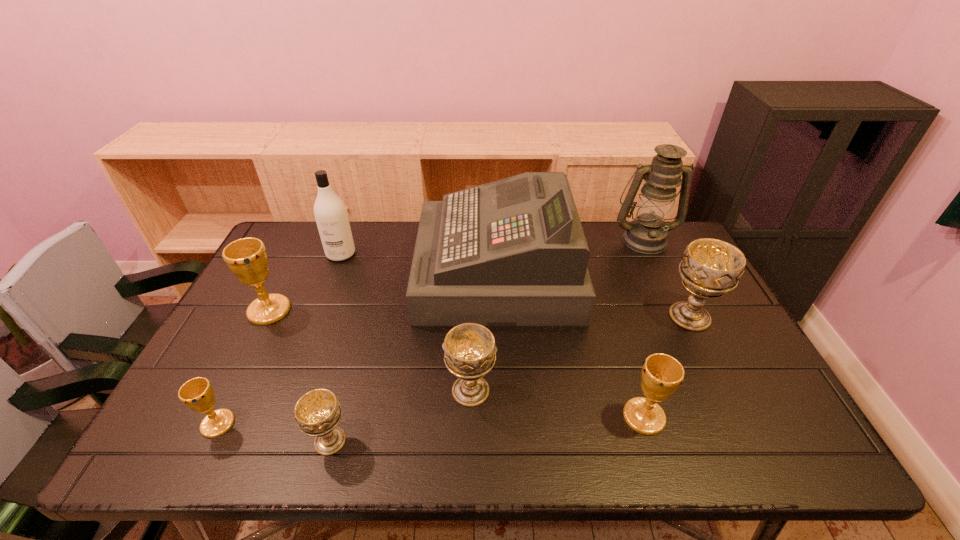
Find the location of `oil lamp`. oil lamp is located at coordinates (647, 234).

Locate an element on the screen. Image resolution: width=960 pixels, height=540 pixels. cash register is located at coordinates (512, 252).

Identify the location of white shampoo. This screenshot has height=540, width=960. (330, 213).

Find the location of a particular element. The height and width of the screenshot is (540, 960). shampoo is located at coordinates 330,213.

Locate an element on the screen. The height and width of the screenshot is (540, 960). the biggest gold chalice is located at coordinates (247, 258).

Locate an element on the screen. This screenshot has width=960, height=540. the rightmost chalice is located at coordinates (710, 268).

The image size is (960, 540). In order to click on the biggest white chalice in this screenshot , I will do `click(710, 268)`.

Where is `the second nearest white chalice`? the second nearest white chalice is located at coordinates (470, 353).

Image resolution: width=960 pixels, height=540 pixels. I want to click on the second white chalice from left to right, so click(x=470, y=353).

Find the location of a particular element. the rightmost gold chalice is located at coordinates (662, 374).